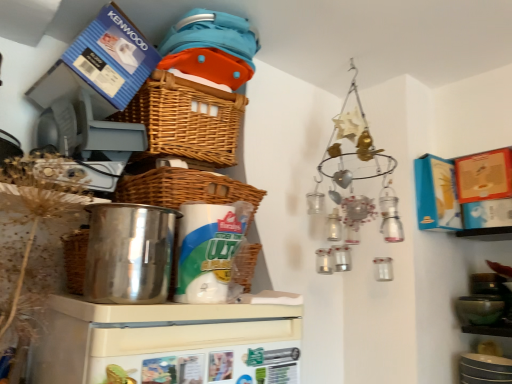
Question: Does woven brown basket at upper center, positioned as the second basket in bottom-to-top order, come in front of polished stainless steel pot at left, the first appliance from the top?

Choices:
 (A) yes
 (B) no

Answer: (B)

Question: Can polished stainless steel pot at left, the first appliance from the top, be found inside woven brown basket at upper center, positioned as the second basket in bottom-to-top order?

Choices:
 (A) yes
 (B) no

Answer: (B)

Question: Can you confirm if woven brown basket at upper center, which ranks as the 1th basket in top-to-bottom order, is wider than polished stainless steel pot at left, which is the 2th appliance from bottom to top?

Choices:
 (A) yes
 (B) no

Answer: (A)

Question: Can you confirm if woven brown basket at upper center, positioned as the second basket in bottom-to-top order, is taller than polished stainless steel pot at left, which is the 2th appliance from bottom to top?

Choices:
 (A) no
 (B) yes

Answer: (B)

Question: Is woven brown basket at upper center, positioned as the second basket in bottom-to-top order, oriented towards polished stainless steel pot at left, the first appliance from the top?

Choices:
 (A) no
 (B) yes

Answer: (A)

Question: Can you confirm if woven brown basket at upper center, positioned as the second basket in bottom-to-top order, is shorter than polished stainless steel pot at left, which is the 2th appliance from bottom to top?

Choices:
 (A) yes
 (B) no

Answer: (B)

Question: Is white plastic refrigerator at center, which is the second appliance in top-to-bottom order, at the left side of polished stainless steel pot at left, the first appliance from the top?

Choices:
 (A) yes
 (B) no

Answer: (B)

Question: From a real-world perspective, is white plastic refrigerator at center, which is the second appliance in top-to-bottom order, on top of polished stainless steel pot at left, which is the 2th appliance from bottom to top?

Choices:
 (A) no
 (B) yes

Answer: (A)

Question: Is white plastic refrigerator at center, which ranks as the first appliance in bottom-to-top order, far from polished stainless steel pot at left, the first appliance from the top?

Choices:
 (A) no
 (B) yes

Answer: (A)

Question: Considering the relative sizes of white plastic refrigerator at center, which is the second appliance in top-to-bottom order, and polished stainless steel pot at left, the first appliance from the top, in the image provided, is white plastic refrigerator at center, which is the second appliance in top-to-bottom order, smaller than polished stainless steel pot at left, the first appliance from the top,?

Choices:
 (A) no
 (B) yes

Answer: (A)

Question: Considering the relative positions of white plastic refrigerator at center, which is the second appliance in top-to-bottom order, and polished stainless steel pot at left, which is the 2th appliance from bottom to top, in the image provided, is white plastic refrigerator at center, which is the second appliance in top-to-bottom order, in front of polished stainless steel pot at left, which is the 2th appliance from bottom to top,?

Choices:
 (A) no
 (B) yes

Answer: (B)

Question: Are white plastic refrigerator at center, which is the second appliance in top-to-bottom order, and polished stainless steel pot at left, the first appliance from the top, making contact?

Choices:
 (A) yes
 (B) no

Answer: (B)

Question: Does woven brown basket at center, which is the first basket from bottom to top, come in front of polished stainless steel pot at left, the first appliance from the top?

Choices:
 (A) yes
 (B) no

Answer: (B)